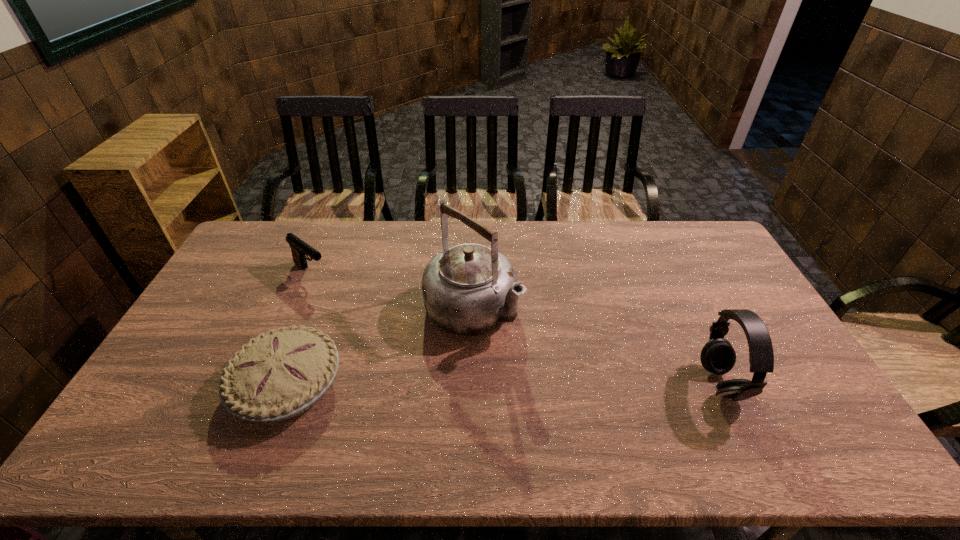
In the image, there is a desktop. In order to click on vacant space at the near edge in this screenshot , I will do `click(383, 399)`.

Where is `vacant space at the left edge of the desktop`? The height and width of the screenshot is (540, 960). vacant space at the left edge of the desktop is located at coordinates (151, 386).

Where is `vacant region at the far left corner of the desktop`? vacant region at the far left corner of the desktop is located at coordinates (267, 252).

Find the location of a particular element. The image size is (960, 540). free space between the second object from right to left and the earphone is located at coordinates (596, 347).

At what (x,y) coordinates should I click in order to perform the action: click on free area in between the pie and the third shortest object. Please return your answer as a coordinate pair (x, y). Looking at the image, I should click on (503, 383).

Image resolution: width=960 pixels, height=540 pixels. I want to click on free point between the kettle and the rightmost object, so (596, 347).

This screenshot has height=540, width=960. Identify the location of vacant area that lies between the shortest object and the kettle. [x=380, y=347].

Where is `free space between the kettle and the third shortest object`? Image resolution: width=960 pixels, height=540 pixels. free space between the kettle and the third shortest object is located at coordinates (596, 347).

Where is `free spot between the third tallest object and the third object from left to right`? free spot between the third tallest object and the third object from left to right is located at coordinates (392, 292).

What are the coordinates of `empty location between the pie and the kettle` in the screenshot? It's located at (380, 347).